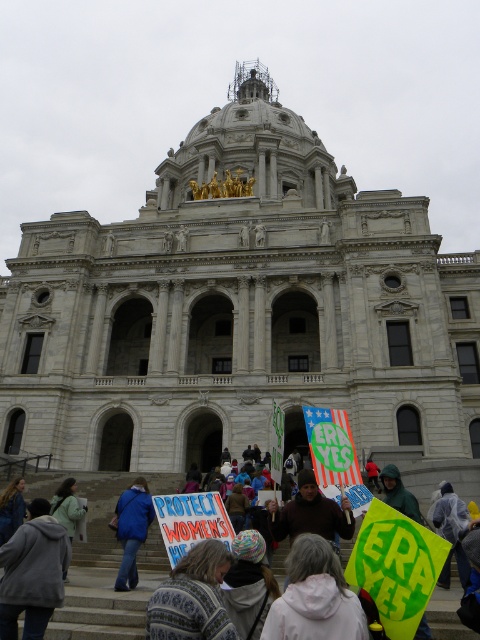
Who is higher up, knitted sweater at lower center or light green jacket at lower left?

knitted sweater at lower center is above.

Consider the image. Does knitted sweater at lower center appear on the right side of light green jacket at lower left?

Yes, knitted sweater at lower center is to the right of light green jacket at lower left.

You are a GUI agent. You are given a task and a screenshot of the screen. Output one action in this format:
    pyautogui.click(x=<x>, y=<y>)
    Task: Click on the knitted sweater at lower center
    Image resolution: width=480 pixels, height=640 pixels.
    Given the screenshot: What is the action you would take?
    pyautogui.click(x=192, y=596)

Who is higher up, gray hoodie at lower left or light green jacket at lower left?

gray hoodie at lower left is above.

This screenshot has height=640, width=480. I want to click on gray hoodie at lower left, so click(33, 572).

Is point (11, 541) closer to camera compared to point (72, 534)?

Yes.

Where is `gray hoodie at lower left`? gray hoodie at lower left is located at coordinates (33, 572).

Does white fleece jacket at lower center lie in front of blue fabric jacket at lower left?

Yes.

Can you confirm if white fleece jacket at lower center is positioned to the left of blue fabric jacket at lower left?

No, white fleece jacket at lower center is not to the left of blue fabric jacket at lower left.

Is point (317, 560) more distant than point (137, 516)?

No, it is in front of (137, 516).

The height and width of the screenshot is (640, 480). Find the location of `white fleece jacket at lower center`. white fleece jacket at lower center is located at coordinates (314, 596).